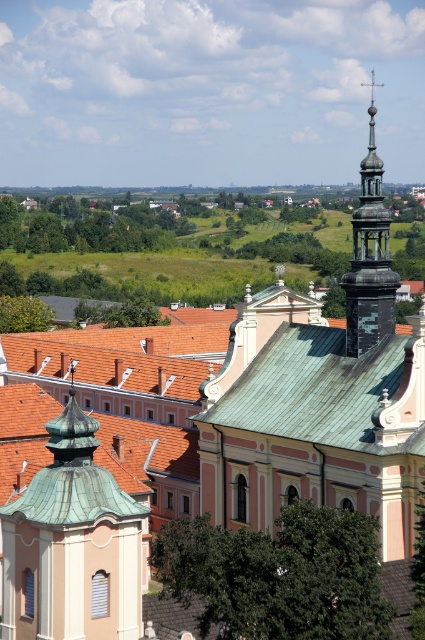
Who is higher up, green copper dome at center or green metal roof at center?

green metal roof at center is higher up.

Who is positioned more to the right, green copper dome at center or green metal roof at center?

Positioned to the right is green metal roof at center.

Does point (104, 512) come closer to viewer compared to point (367, 429)?

That is True.

The image size is (425, 640). I want to click on green copper dome at center, so click(71, 545).

Who is shorter, green metal roof at center or shiny copper spire at upper right?

With less height is green metal roof at center.

Can you confirm if green metal roof at center is positioned to the right of shiny copper spire at upper right?

Incorrect, green metal roof at center is not on the right side of shiny copper spire at upper right.

Which is behind, point (308, 403) or point (374, 209)?

The point (374, 209) is more distant.

Identify the location of green metal roof at center. (311, 388).

Does point (42, 472) lie behind point (373, 148)?

No, it is not.

In the scene shown: Is green copper dome at center thinner than shiny copper spire at upper right?

Yes, green copper dome at center is thinner than shiny copper spire at upper right.

This screenshot has width=425, height=640. In order to click on green copper dome at center in this screenshot , I will do `click(71, 545)`.

At what (x,y) coordinates should I click in order to perform the action: click on green copper dome at center. Please return your answer as a coordinate pair (x, y). The height and width of the screenshot is (640, 425). Looking at the image, I should click on (71, 545).